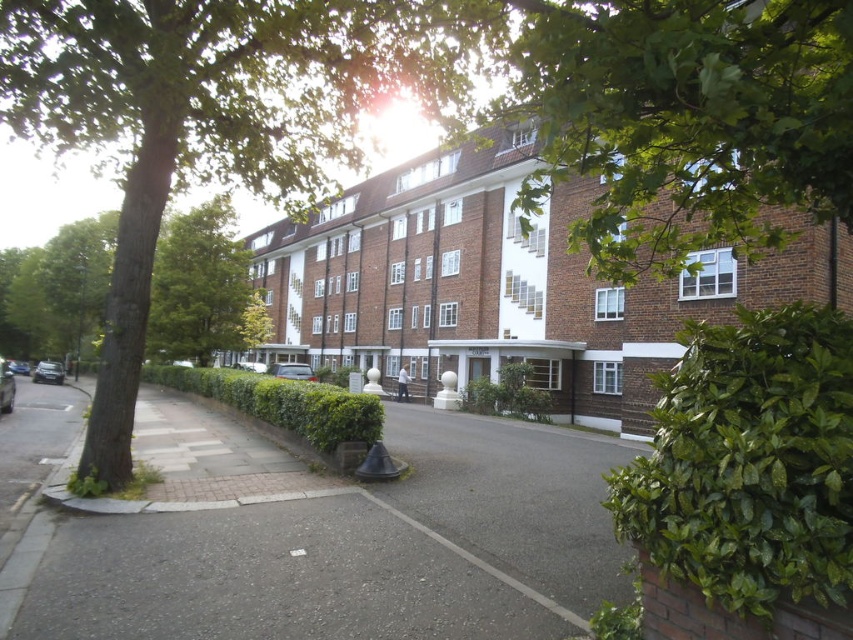
You are standing at the point closest to the building in the image. Which of the two points, point (657, 595) or point (190, 301), is closer to you?

Point (657, 595) is in front of point (190, 301), so it is closer to you.

You are standing on the sidewalk in front of the brown brick building at center and want to take a photo of the entire building without any obstructions. Is the green leafy tree at upper left blocking your view of the building?

The green leafy tree at upper left is much taller than the brown brick building at center, so it may block part of the building when taking a photo from the sidewalk.

You are standing in front of the residential building and want to take a photo of the building without any obstructions. Based on the green leafy tree at upper left, where should you position yourself to avoid it blocking the view?

To avoid the green leafy tree at upper left blocking the view, position yourself to the right side of the image, as the tree is located at the upper left corner near coordinates (219, 116).